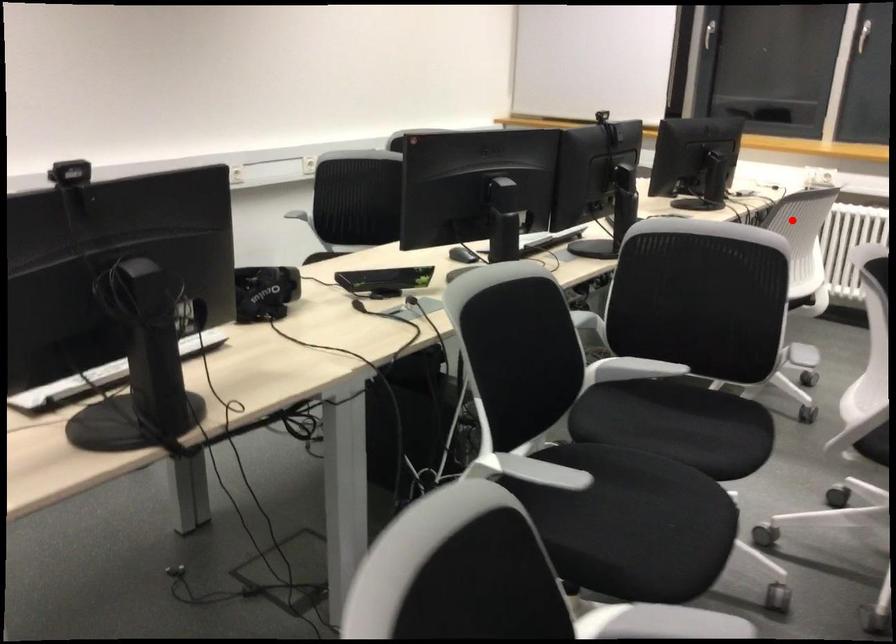
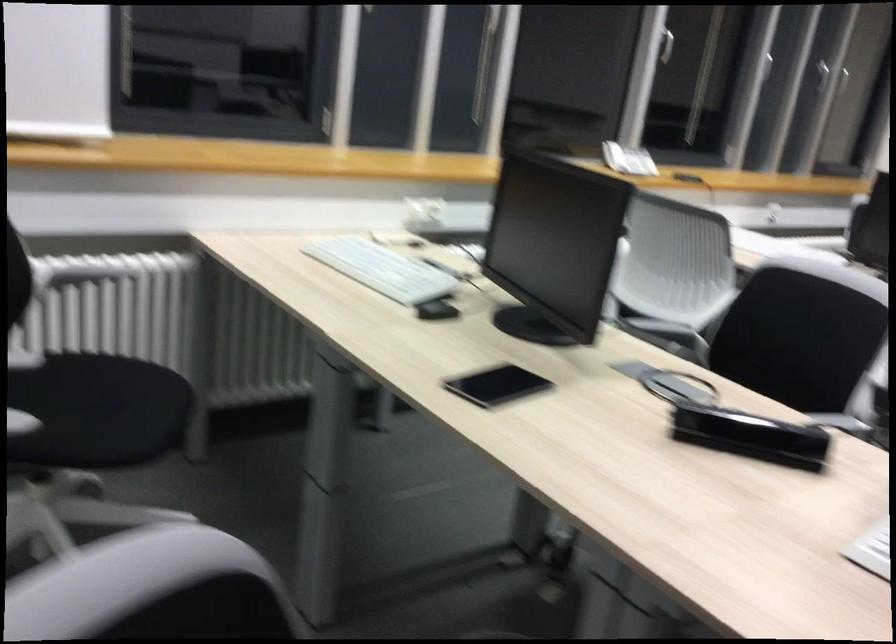
Locate, in the second image, the point that corresponds to the highlighted location in the first image.

(798, 337)